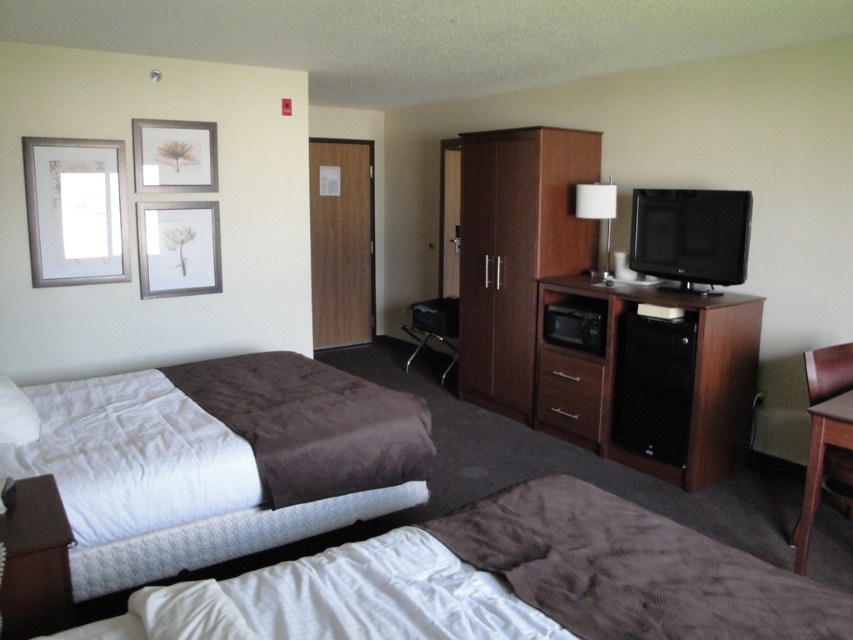
You are a hotel guest who needs to place a 2 meter long luggage on the floor between the velvet brown bed at lower left and the brown wood drawer at lower center. Can you fit the luggage horizontally between them without moving either object?

The distance between the velvet brown bed at lower left and the brown wood drawer at lower center is 2.11 meters. Since the luggage is 2 meters long, it can fit horizontally between them as there is enough space.